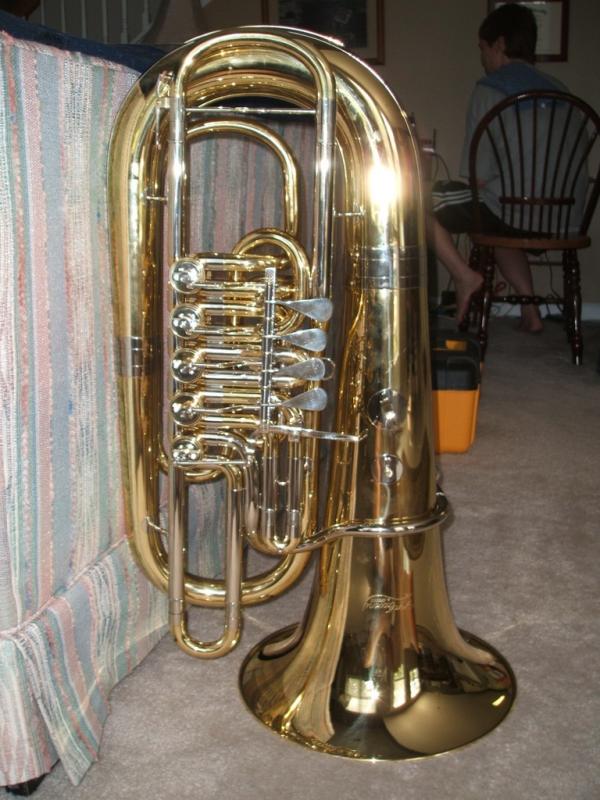
Find the location of a particular element. This screenshot has width=600, height=800. pictures is located at coordinates (344, 20), (545, 37).